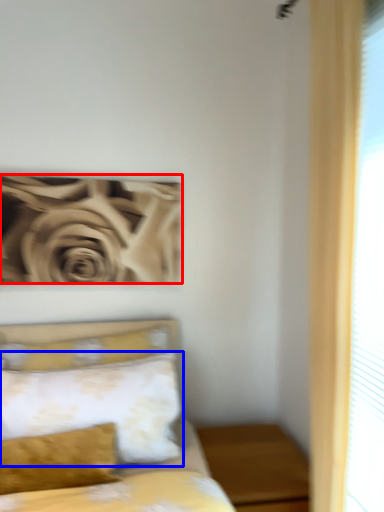
Question: Among these objects, which one is nearest to the camera, rose (highlighted by a red box) or pillow (highlighted by a blue box)?

Choices:
 (A) rose
 (B) pillow

Answer: (B)